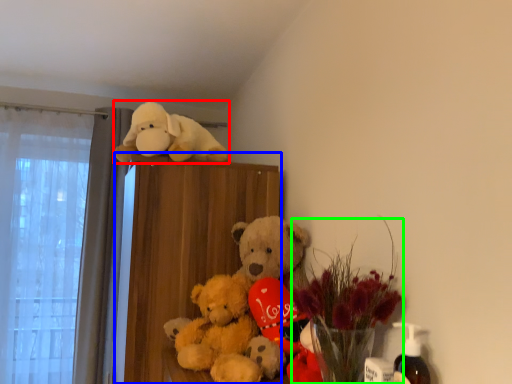
Question: Which object is the farthest from toy (highlighted by a red box)? Choose among these: bookshelf (highlighted by a blue box) or floral arrangement (highlighted by a green box).

Choices:
 (A) bookshelf
 (B) floral arrangement

Answer: (B)